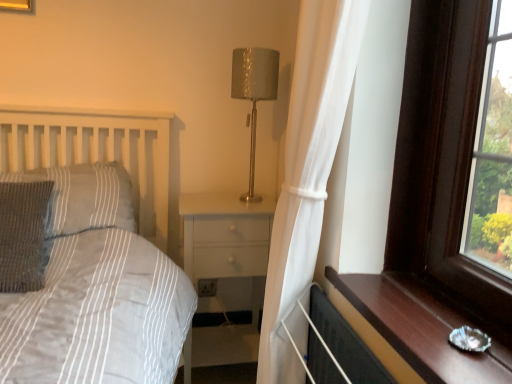
The width and height of the screenshot is (512, 384). In order to click on free spot above brown wooden window sill at right (from a real-world perspective) in this screenshot , I will do `click(424, 305)`.